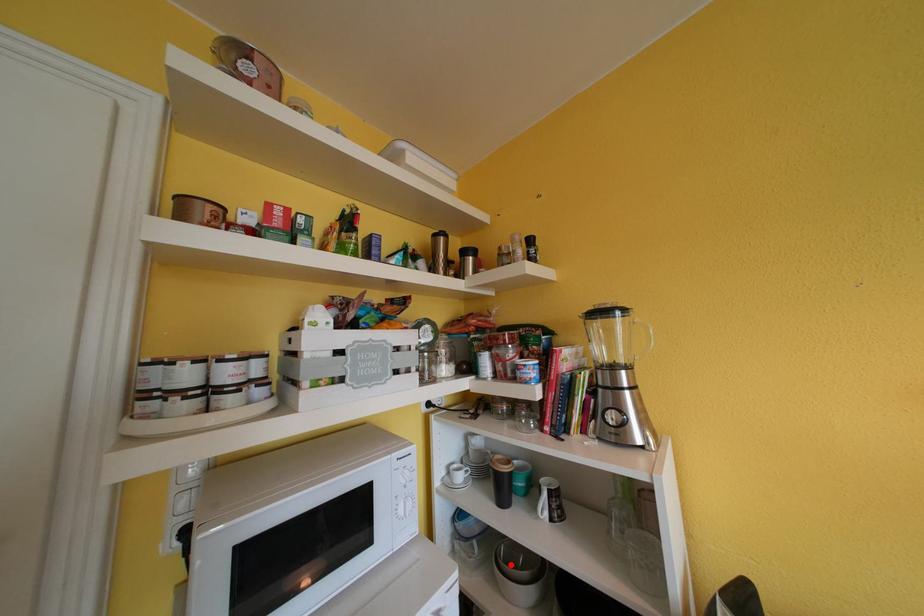
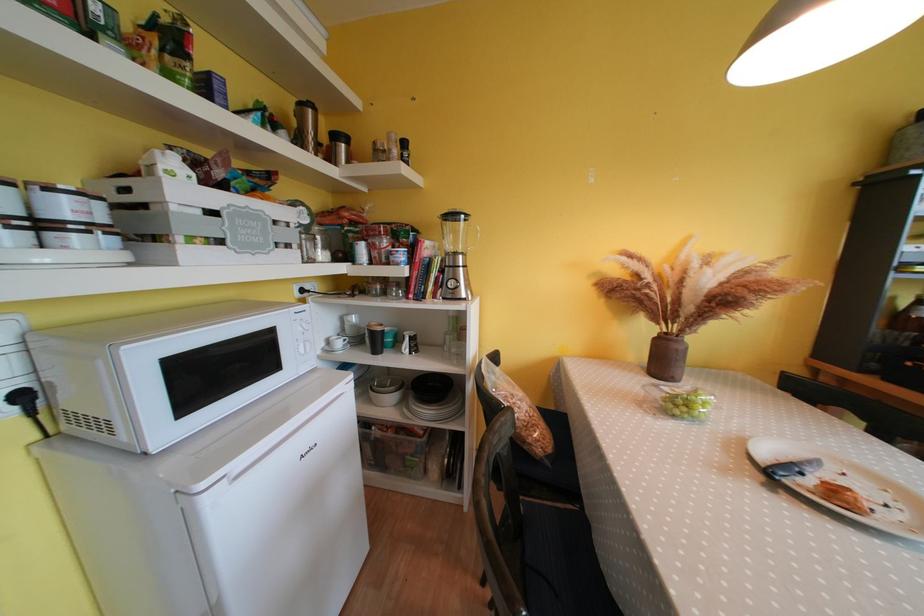
The point at the highlighted location is marked in the first image. Where is the corresponding point in the second image?

(383, 390)